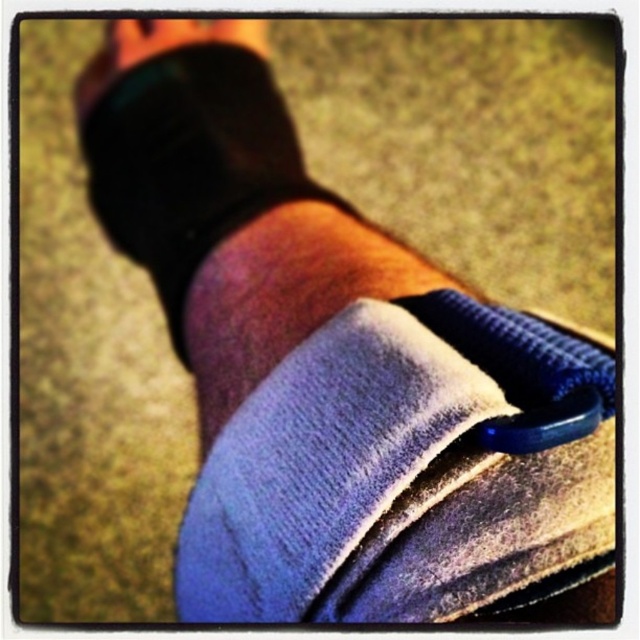
You are a photographer setting up a shoot in the scene described. You need to place a 40 cm ruler between the black matte sock at center and the velvet blue strap at center. Will the ruler fit entirely between them without overlapping either object?

The distance between the black matte sock at center and the velvet blue strap at center is 38.84 centimeters. Since the ruler is 40 cm long, it will not fit entirely between them without overlapping either object.

You are a fashion designer working on a new collection. You have two socks in front of you, the blue velvety sock at center and the black matte sock at center. Which sock should you choose if you want to create a design that requires a narrower width for a snug fit?

The blue velvety sock at center has a smaller width than the black matte sock at center, so it would be the better choice for a snug fit requiring narrower width.

You are standing in a park and see a person sitting with a blue velvety sock at center. If you want to pick up the sock without moving closer, is it within your reach?

The blue velvety sock at center is 20.76 inches away from viewer, so yes, it is within reach if you can extend your arm that far.